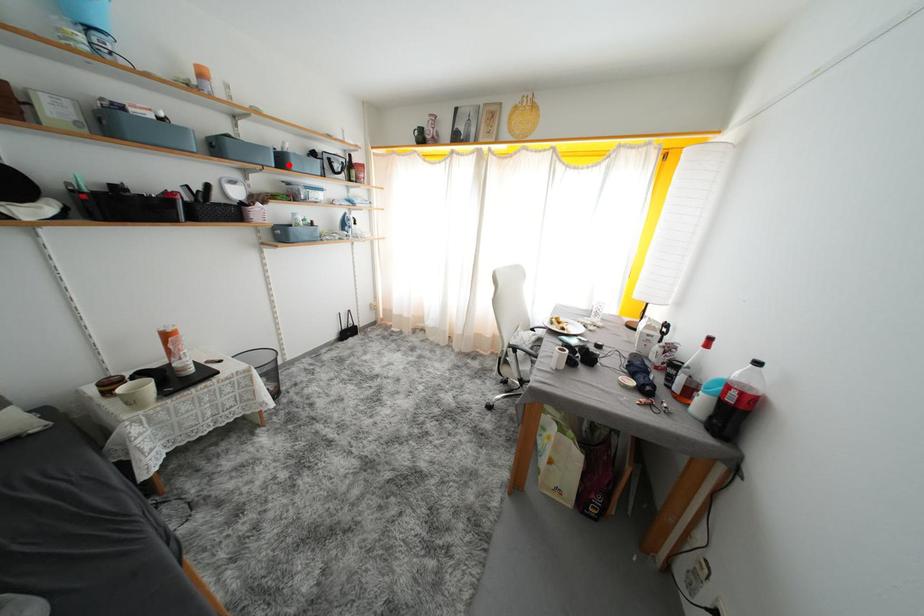
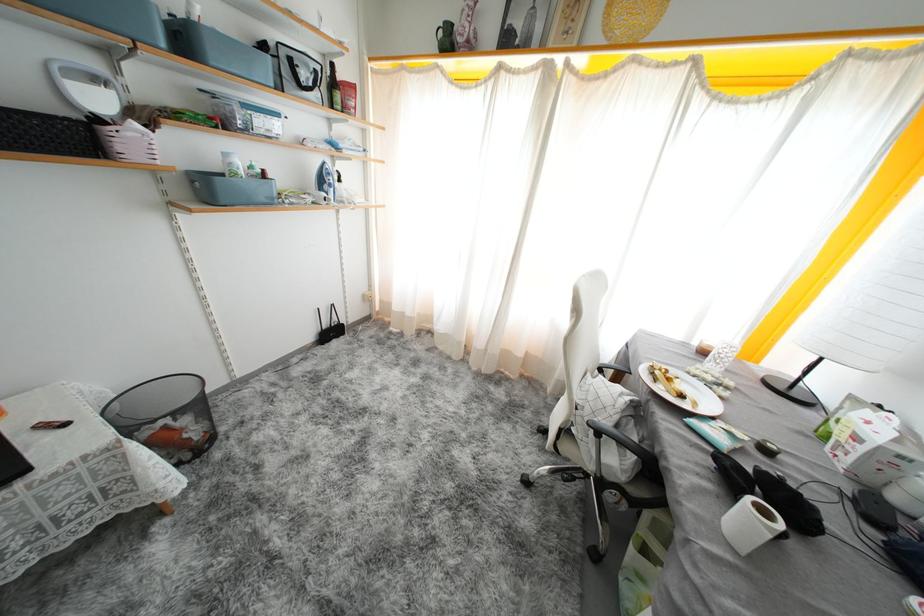
In the second image, find the point that corresponds to the highlighted location in the first image.

(190, 44)